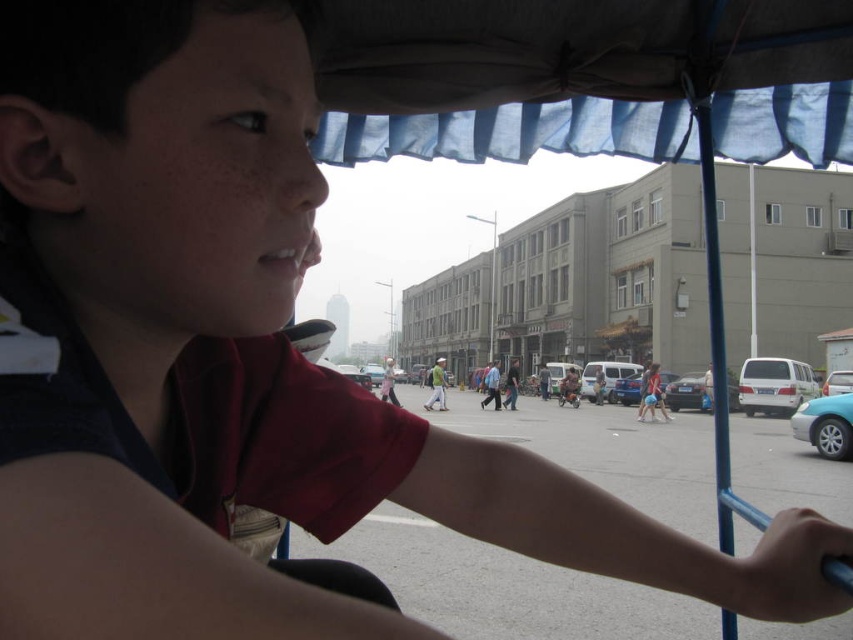
You are standing in front of the rickshaw and want to take a photo of the point at coordinates point [849,429]. Can you estimate how far you need to move forward or backward to focus on this point? The camera you are using has a focal length of 50mm and the sensor size is 24mm x 36mm.

The point at coordinates point [849,429] is 15.23 meters from the camera. To focus on this point, you need to ensure the camera is positioned at a distance of approximately 15.23 meters from the point. Since the camera is already at that distance, no adjustment is needed.

You are inside a rickshaw and want to know which of the two points, point (781, 390) or point (735, 390), is closer to you. Based on the scene description, which point is nearer?

Point (781, 390) is closer to the viewer than point (735, 390).